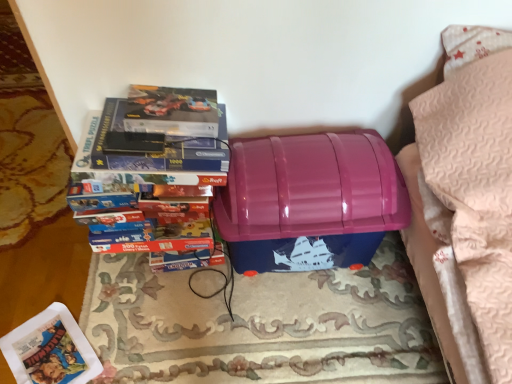
Find the location of `free space below matte plastic paperback book at lower left (from a real-world perspective)`. free space below matte plastic paperback book at lower left (from a real-world perspective) is located at coordinates (51, 353).